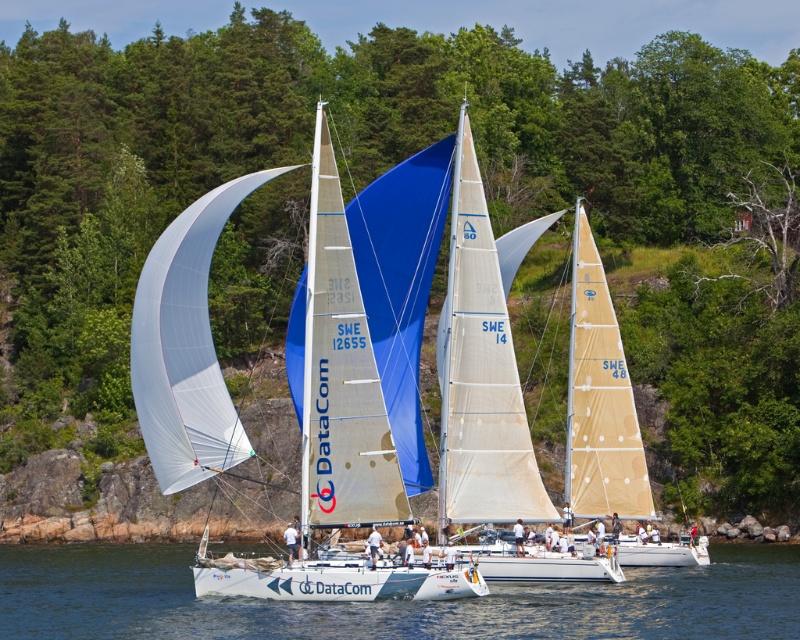
Is white matte sailboat at center further to camera compared to transparent water at center?

Yes, white matte sailboat at center is further from the viewer.

Between white matte sailboat at center and transparent water at center, which one has less height?

Standing shorter between the two is transparent water at center.

Which is behind, point (256, 588) or point (756, 572)?

Point (756, 572)

Identify the location of white matte sailboat at center. pyautogui.click(x=341, y=376).